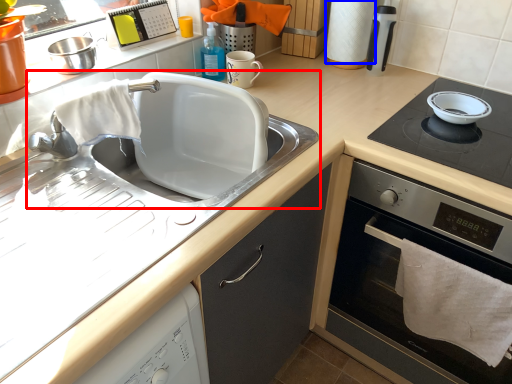
Question: Which point is closer to the camera, sink (highlighted by a red box) or paper towel (highlighted by a blue box)?

Choices:
 (A) sink
 (B) paper towel

Answer: (A)